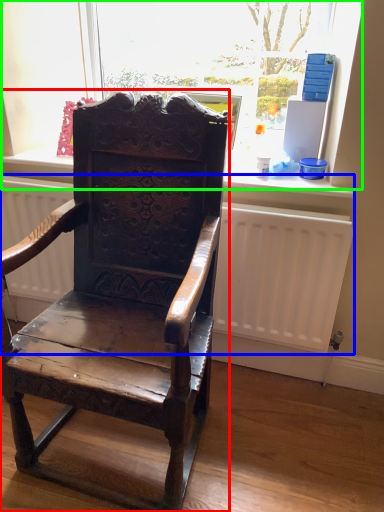
Question: Which object is the closest to the chair (highlighted by a red box)? Choose among these: radiator (highlighted by a blue box) or bay window (highlighted by a green box).

Choices:
 (A) radiator
 (B) bay window

Answer: (A)